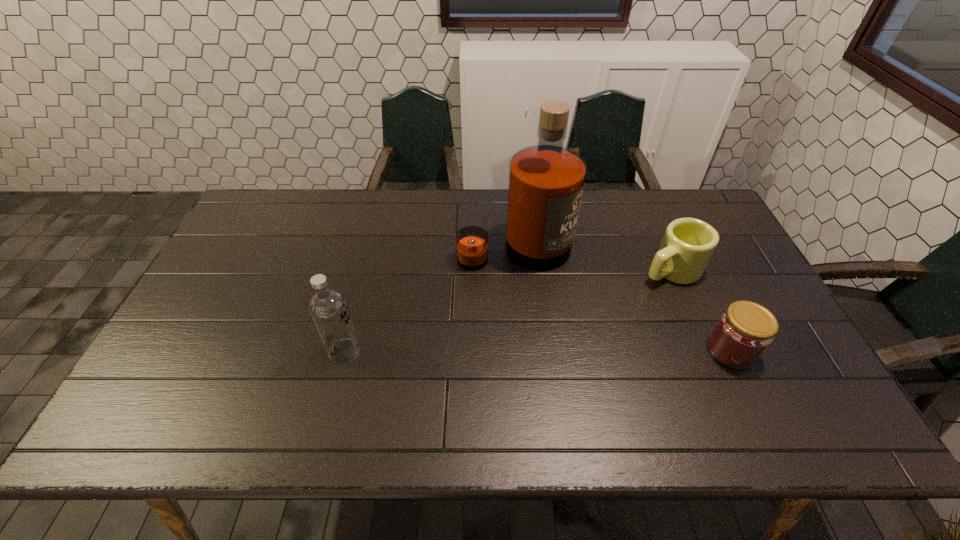
Identify the location of vacant space on the desktop that is between the third shortest object and the jam and is positioned on the front label of the second object from left to right. This screenshot has width=960, height=540. (581, 350).

Identify the location of free space on the desktop that is between the leftmost object and the jam and is positioned with the handle on the side of the mug. This screenshot has width=960, height=540. (528, 351).